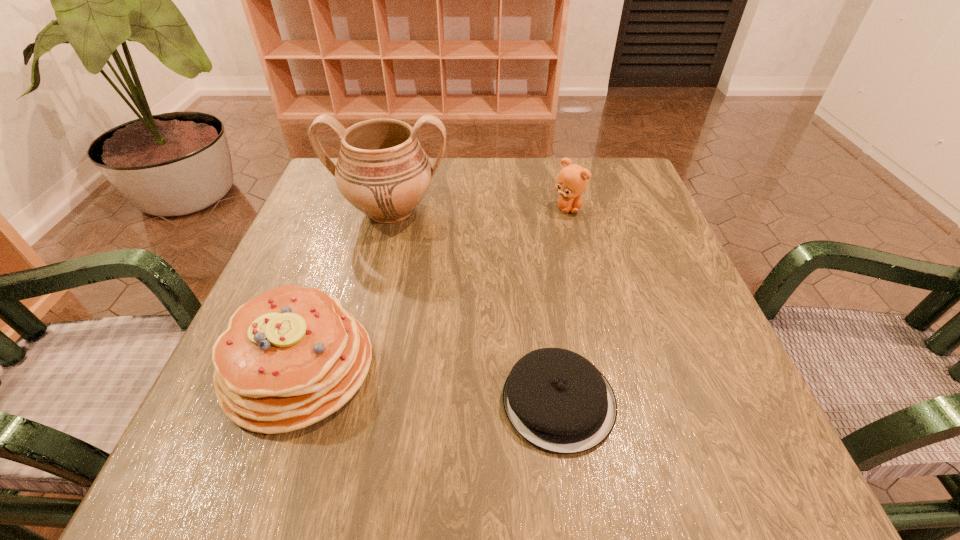
The height and width of the screenshot is (540, 960). I want to click on teddy bear located in the far edge section of the desktop, so click(x=572, y=180).

Where is `urn located at the left edge`? urn located at the left edge is located at coordinates (382, 170).

The width and height of the screenshot is (960, 540). Find the location of `pancake positioned at the left edge`. pancake positioned at the left edge is located at coordinates (290, 357).

In order to click on object present at the far left corner in this screenshot , I will do `click(382, 170)`.

You are a GUI agent. You are given a task and a screenshot of the screen. Output one action in this format:
    pyautogui.click(x=<x>, y=<y>)
    Task: Click on the object present at the near left corner
    
    Given the screenshot: What is the action you would take?
    pyautogui.click(x=290, y=357)

Identify the location of vacant space at the far edge of the desktop. This screenshot has width=960, height=540. coord(498,187).

The width and height of the screenshot is (960, 540). In order to click on free space at the near edge of the desktop in this screenshot , I will do `click(322, 455)`.

This screenshot has height=540, width=960. I want to click on vacant area at the left edge of the desktop, so click(332, 293).

In the image, there is a desktop. What are the coordinates of `vacant space at the right edge` in the screenshot? It's located at (604, 246).

The width and height of the screenshot is (960, 540). I want to click on free region at the far right corner, so click(624, 202).